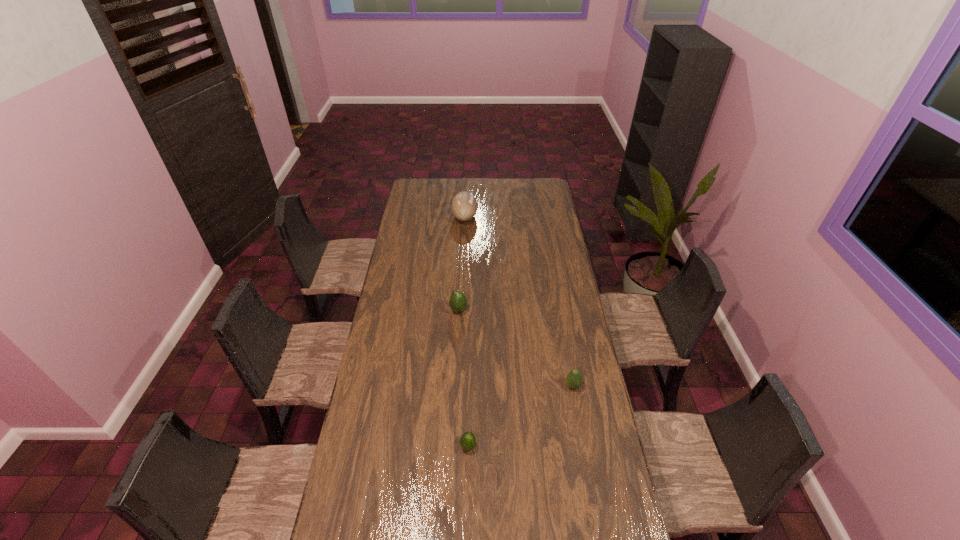
Identify the location of football (American). (464, 206).

At what (x,y) coordinates should I click in order to perform the action: click on the tallest object. Please return your answer as a coordinate pair (x, y). Looking at the image, I should click on (464, 206).

The width and height of the screenshot is (960, 540). What are the coordinates of `the tallest avocado` in the screenshot? It's located at (458, 302).

You are a GUI agent. You are given a task and a screenshot of the screen. Output one action in this format:
    pyautogui.click(x=<x>, y=<y>)
    Task: Click on the second farthest object
    The image size is (960, 540).
    Given the screenshot: What is the action you would take?
    pyautogui.click(x=458, y=302)

This screenshot has width=960, height=540. I want to click on the second farthest avocado, so [574, 379].

Identify the location of the second nearest object. (574, 379).

Find the location of `the nearest object`. the nearest object is located at coordinates (468, 440).

This screenshot has height=540, width=960. Find the location of `vacant point located on the laces of the tallest object`. vacant point located on the laces of the tallest object is located at coordinates (512, 217).

You are a GUI agent. You are given a task and a screenshot of the screen. Output one action in this format:
    pyautogui.click(x=<x>, y=<y>)
    Task: Click on the vacant area located 0.230m on the right of the farthest avocado
    The height and width of the screenshot is (540, 960).
    Given the screenshot: What is the action you would take?
    pyautogui.click(x=517, y=310)

I want to click on free region located 0.400m on the front of the second nearest avocado, so click(x=594, y=499).